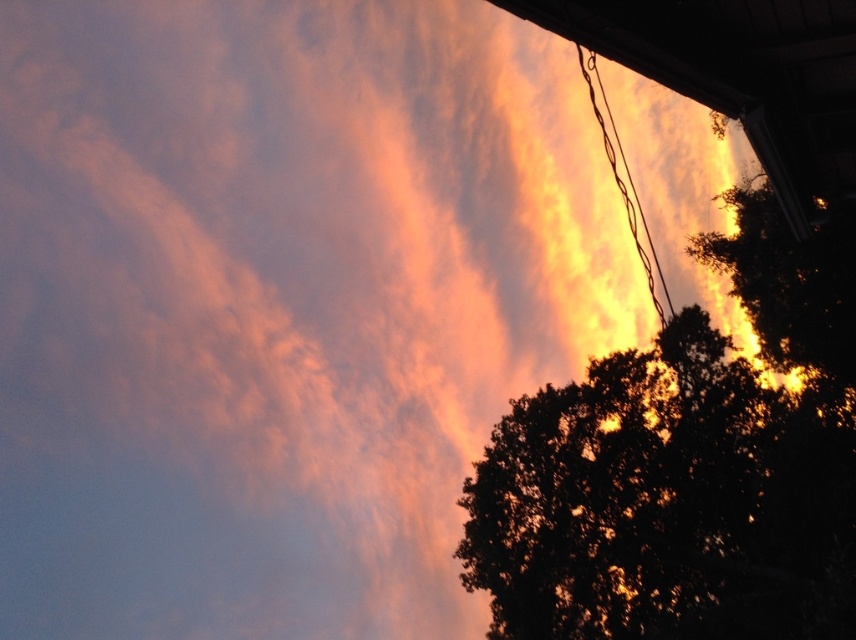
Question: Is silhouette leafy tree at upper right smaller than yellow-orange wire at upper right?

Choices:
 (A) yes
 (B) no

Answer: (B)

Question: Which of the following is the closest to the observer?

Choices:
 (A) (700, 467)
 (B) (629, 204)

Answer: (A)

Question: Can you confirm if silhouette leafy tree at upper right is smaller than yellow-orange wire at upper right?

Choices:
 (A) yes
 (B) no

Answer: (B)

Question: Which object is closer to the camera taking this photo?

Choices:
 (A) yellow-orange wire at upper right
 (B) silhouette leafy tree at upper right

Answer: (A)

Question: Does silhouette leafy tree at upper right appear over yellow-orange wire at upper right?

Choices:
 (A) yes
 (B) no

Answer: (B)

Question: Which point is closer to the camera?

Choices:
 (A) yellow-orange wire at upper right
 (B) silhouette leafy tree at upper right

Answer: (A)